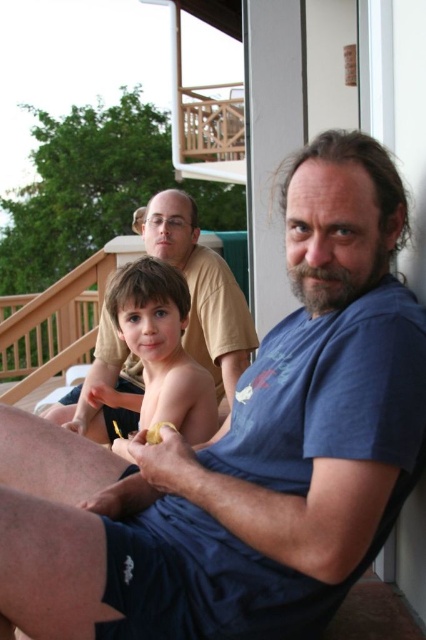
Question: Which point is closer to the camera taking this photo?

Choices:
 (A) (207, 344)
 (B) (155, 378)

Answer: (B)

Question: Is matte yellow shirt at upper center to the right of smooth skin child at center from the viewer's perspective?

Choices:
 (A) yes
 (B) no

Answer: (A)

Question: Is matte yellow shirt at upper center smaller than smooth skin child at center?

Choices:
 (A) no
 (B) yes

Answer: (A)

Question: Which object appears closest to the camera in this image?

Choices:
 (A) matte yellow shirt at upper center
 (B) smooth skin child at center

Answer: (B)

Question: Can you confirm if matte yellow shirt at upper center is positioned below smooth skin child at center?

Choices:
 (A) no
 (B) yes

Answer: (A)